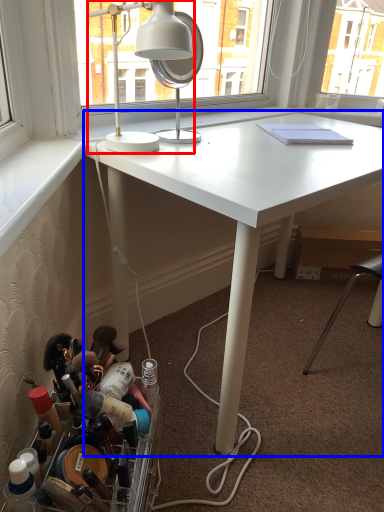
Question: Which object is closer to the camera taking this photo, lamp (highlighted by a red box) or desk (highlighted by a blue box)?

Choices:
 (A) lamp
 (B) desk

Answer: (B)